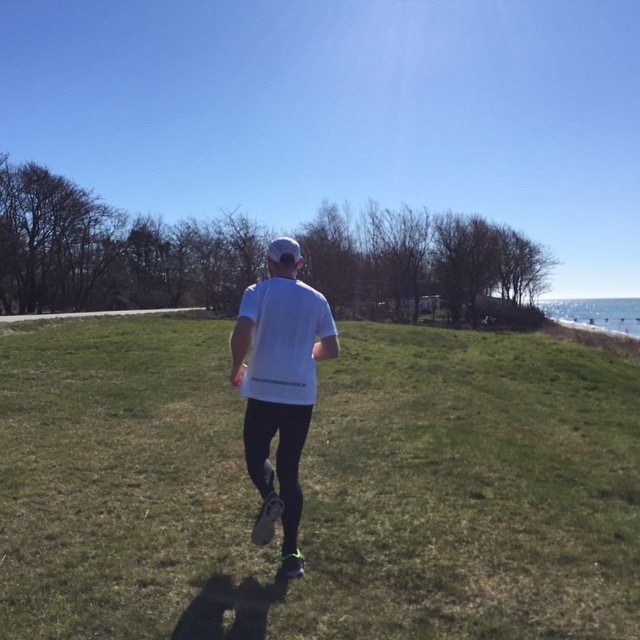
You are standing at the point marked as point [317,486] in the image. What surface are you currently standing on?

You are standing on the green grass at center.

You are taking a photo of the jogging person and want to focus on both point (616, 520) and point (298, 333). Which point is closer to your camera lens?

Point (298, 333) is closer to the camera lens because it is less further than point (616, 520).